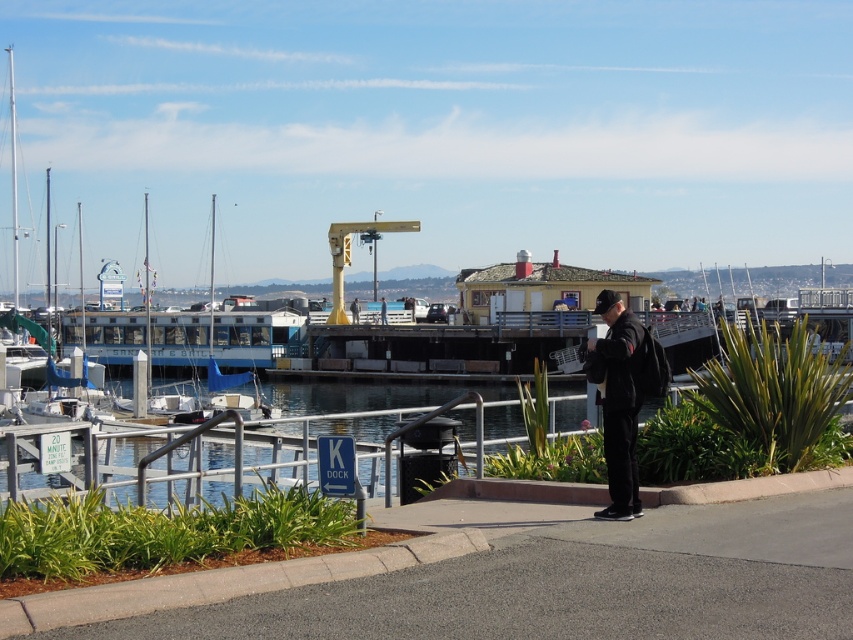
Question: Which object appears closest to the camera in this image?

Choices:
 (A) clear water at dock left
 (B) black matte jacket at center

Answer: (A)

Question: Is clear water at dock left to the right of black matte jacket at center from the viewer's perspective?

Choices:
 (A) yes
 (B) no

Answer: (B)

Question: Which of the following is the closest to the observer?

Choices:
 (A) (602, 358)
 (B) (271, 337)
 (C) (175, 477)

Answer: (A)

Question: Where is clear water at dock left located in relation to blue painted wooden dock at center in the image?

Choices:
 (A) below
 (B) above

Answer: (A)

Question: Is blue painted wooden dock at center thinner than black matte jacket at center?

Choices:
 (A) no
 (B) yes

Answer: (A)

Question: Which object is positioned farthest from the clear water at dock left?

Choices:
 (A) blue painted wooden dock at center
 (B) black matte jacket at center

Answer: (A)